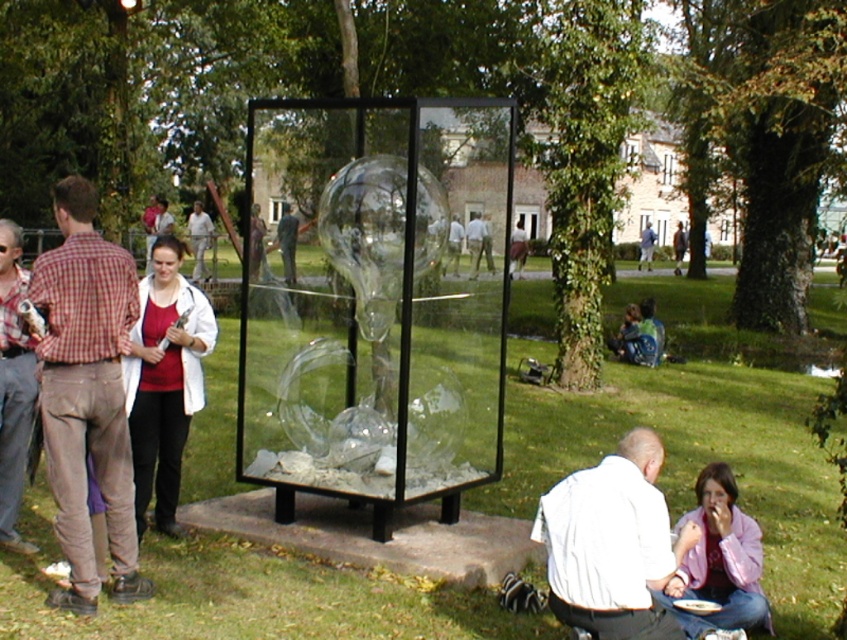
Question: Among these objects, which one is farthest from the camera?

Choices:
 (A) green grass at center
 (B) matte brown pants at left
 (C) white shirt at lower right
 (D) transparent glass sculpture at center

Answer: (D)

Question: Which object is positioned closest to the matte brown pants at left?

Choices:
 (A) matte plaid shirt at left
 (B) green grass at center
 (C) white shirt at lower right
 (D) transparent glass sculpture at center

Answer: (A)

Question: Does transparent glass sculpture at center lie behind green grass at center?

Choices:
 (A) no
 (B) yes

Answer: (B)

Question: Which point appears closest to the camera in this image?

Choices:
 (A) (446, 200)
 (B) (280, 570)

Answer: (B)

Question: Does matte brown pants at left appear under white shirt at lower right?

Choices:
 (A) no
 (B) yes

Answer: (A)

Question: Where is transparent glass sculpture at center located in relation to matte brown pants at left in the image?

Choices:
 (A) above
 (B) below

Answer: (A)